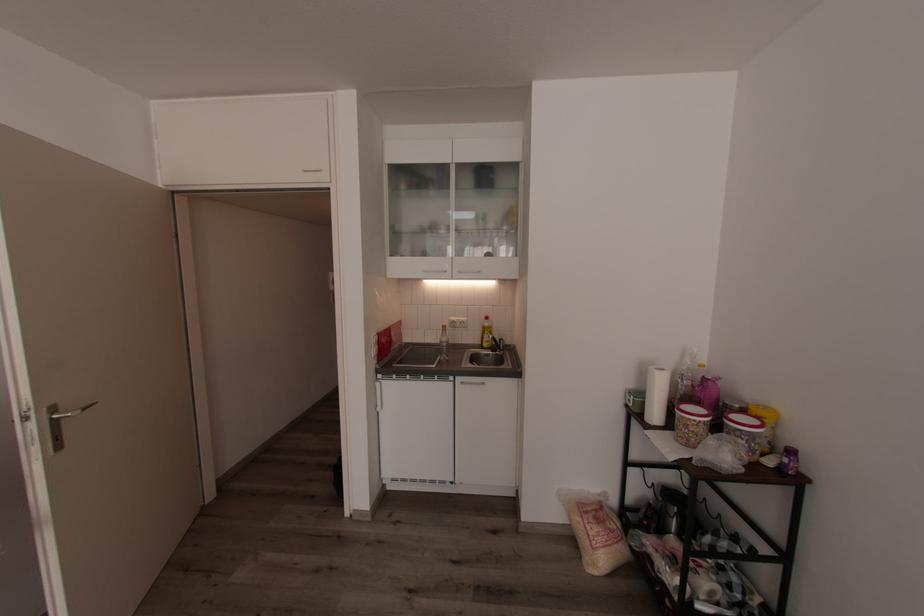
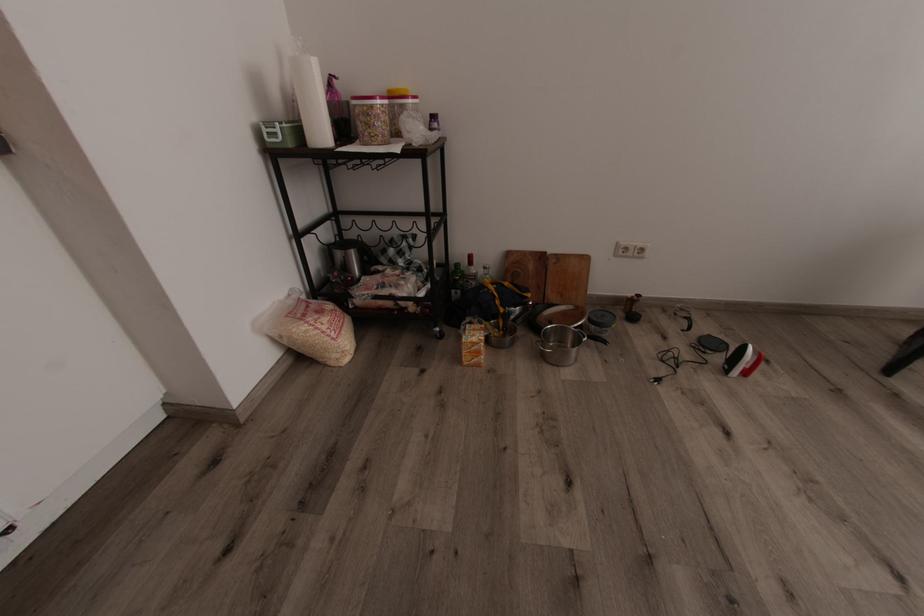
Locate, in the second image, the point that corresponds to (x=637, y=397) in the first image.

(282, 123)